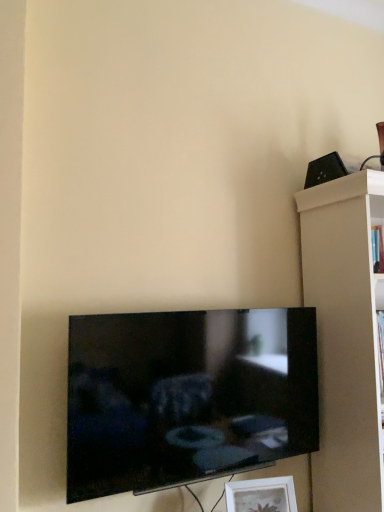
Question: From a real-world perspective, is black glossy tv at lower center above or below black plastic speaker at upper right?

Choices:
 (A) below
 (B) above

Answer: (A)

Question: From the image's perspective, is black glossy tv at lower center located above or below black plastic speaker at upper right?

Choices:
 (A) above
 (B) below

Answer: (B)

Question: Considering the real-world distances, which object is closest to the black glossy tv at lower center?

Choices:
 (A) black plastic speaker at upper right
 (B) white matte shelf at right
 (C) white matte picture frame at lower center

Answer: (C)

Question: Based on their relative distances, which object is farther from the black glossy tv at lower center?

Choices:
 (A) black plastic speaker at upper right
 (B) white matte shelf at right
 (C) white matte picture frame at lower center

Answer: (A)